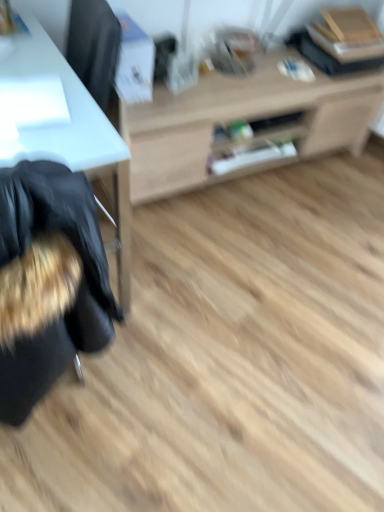
The height and width of the screenshot is (512, 384). I want to click on free region under fuzzy black bean bag chair at left (from a real-world perspective), so click(71, 399).